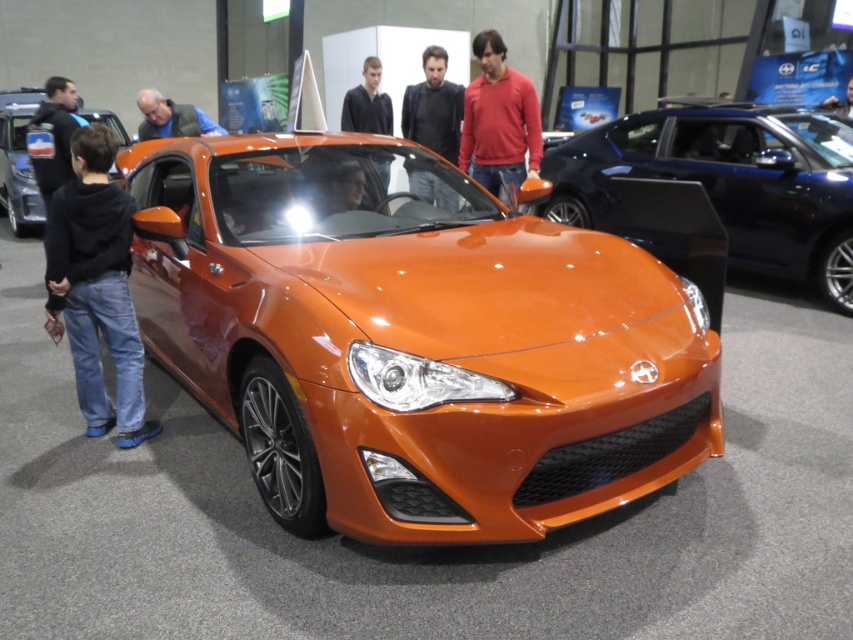
You are a photographer setting up a camera to capture the shiny orange car at center and the shiny metallic car at left. If you want to ensure both cars fit in the frame without cropping, which car should you position closer to the camera?

You should position the shiny metallic car at left closer to the camera since it is narrower than the shiny orange car at center, allowing both to fit within the frame without cropping.

You are a photographer at the car exhibition. You need to take a photo of both the shiny orange car at center and the shiny metallic car at left. If the camera can only focus on one car at a time, which car should you focus on first to ensure it appears larger in the photo?

The shiny orange car at center is larger in size than the shiny metallic car at left, so you should focus on the shiny orange car at center first to ensure it appears larger in the photo.